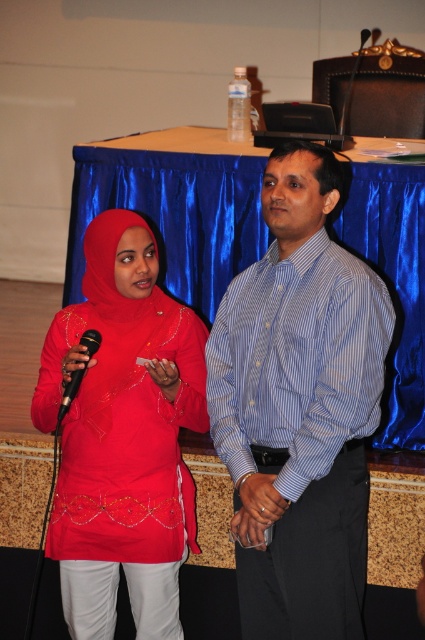
You are organizing a photo shoot and need to ensure that all props and clothing items are appropriately sized for the scene. Given the presence of the matte red dress at center and the black plastic microphone at left, which object would require a larger storage space when packing them separately?

The matte red dress at center requires a larger storage space because it has a larger size compared to the black plastic microphone at left.

You are organizing a photo shoot and need to ensure the matte red dress at center and the black plastic microphone at left are visible in the frame. Based on their sizes, which object should you prioritize positioning closer to the camera to avoid being too small in the photo?

The black plastic microphone at left is smaller than the matte red dress at center, so you should prioritize positioning the microphone closer to the camera to ensure it appears large enough in the photo.

You are an event planner organizing a photo shoot. You need to position a light source to highlight both the matte red dress at center and the black plastic microphone at left. Based on their positions, where should you place the light source to ensure both objects are well lit?

The matte red dress at center is positioned under the black plastic microphone at left. To ensure both are well lit, place the light source above and to the left of the black plastic microphone at left so that it illuminates both the microphone and the dress below it.